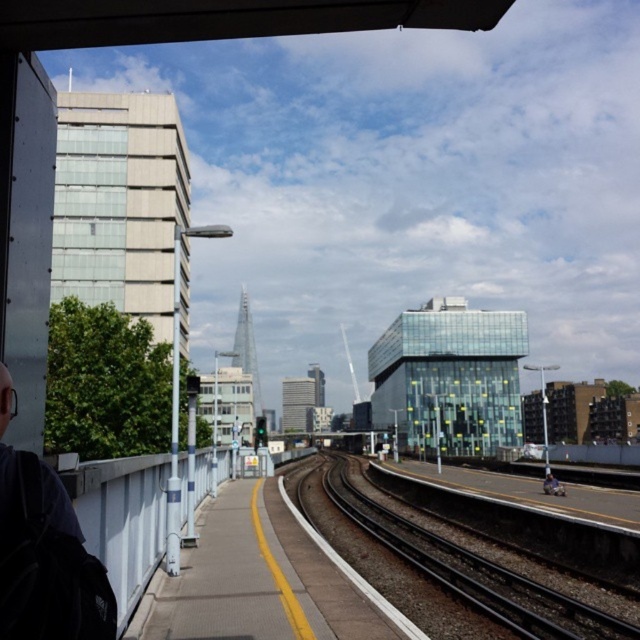
Does dark gray backpack at left come in front of black asphalt track at center?

Yes, it is.

Does dark gray backpack at left appear under black asphalt track at center?

Incorrect, dark gray backpack at left is not positioned below black asphalt track at center.

Is point (72, 509) positioned after point (328, 486)?

No.

At what (x,y) coordinates should I click in order to perform the action: click on dark gray backpack at left. Please return your answer as a coordinate pair (x, y). Looking at the image, I should click on (45, 560).

Does dark gray backpack at left have a greater width compared to light blue denim jacket at lower right?

No, dark gray backpack at left is not wider than light blue denim jacket at lower right.

Is dark gray backpack at left taller than light blue denim jacket at lower right?

In fact, dark gray backpack at left may be shorter than light blue denim jacket at lower right.

Locate an element on the screen. dark gray backpack at left is located at coordinates (45, 560).

The image size is (640, 640). What do you see at coordinates (467, 568) in the screenshot?
I see `black asphalt track at center` at bounding box center [467, 568].

Is black asphalt track at center thinner than light blue denim jacket at lower right?

In fact, black asphalt track at center might be wider than light blue denim jacket at lower right.

Is point (330, 481) positioned in front of point (557, 492)?

No, it is not.

In order to click on black asphalt track at center in this screenshot , I will do `click(467, 568)`.